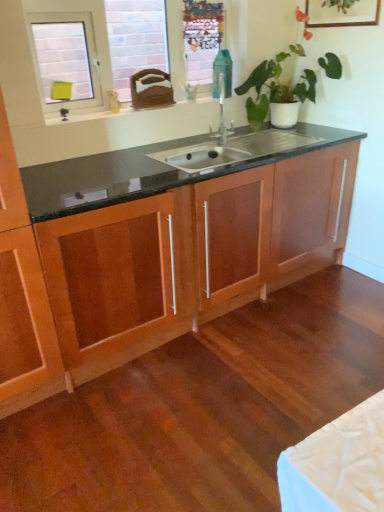
Where is `free space above wooden cabinet at center (from a real-world perspective)`? Image resolution: width=384 pixels, height=512 pixels. free space above wooden cabinet at center (from a real-world perspective) is located at coordinates (184, 159).